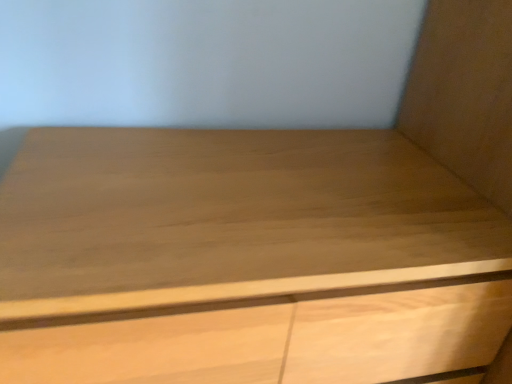
Identify the location of light wood chest of drawers at center. (244, 259).

The image size is (512, 384). What do you see at coordinates (244, 259) in the screenshot? I see `light wood chest of drawers at center` at bounding box center [244, 259].

Where is `light wood chest of drawers at center`? This screenshot has width=512, height=384. light wood chest of drawers at center is located at coordinates (244, 259).